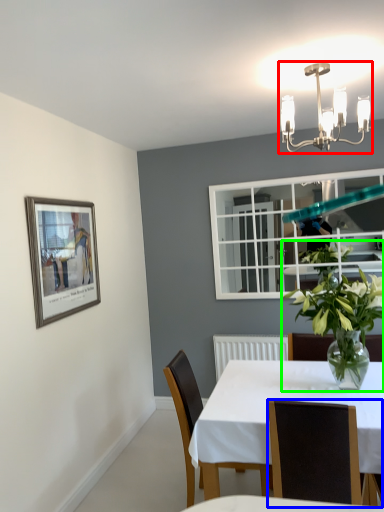
Question: Considering the real-world distances, which object is closest to light fixture (highlighted by a red box)? chair (highlighted by a blue box) or houseplant (highlighted by a green box).

Choices:
 (A) chair
 (B) houseplant

Answer: (B)